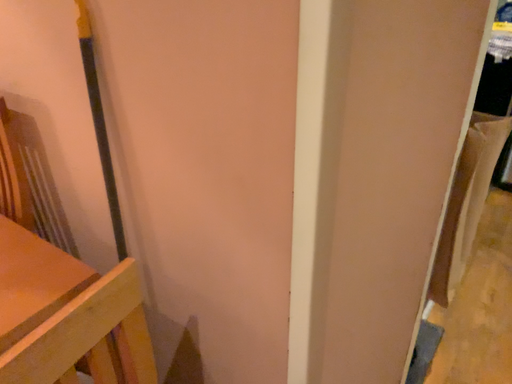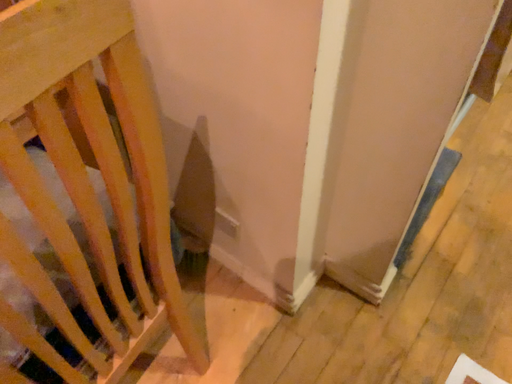
Question: Which way did the camera rotate in the video?

Choices:
 (A) rotated downward
 (B) rotated upward

Answer: (A)